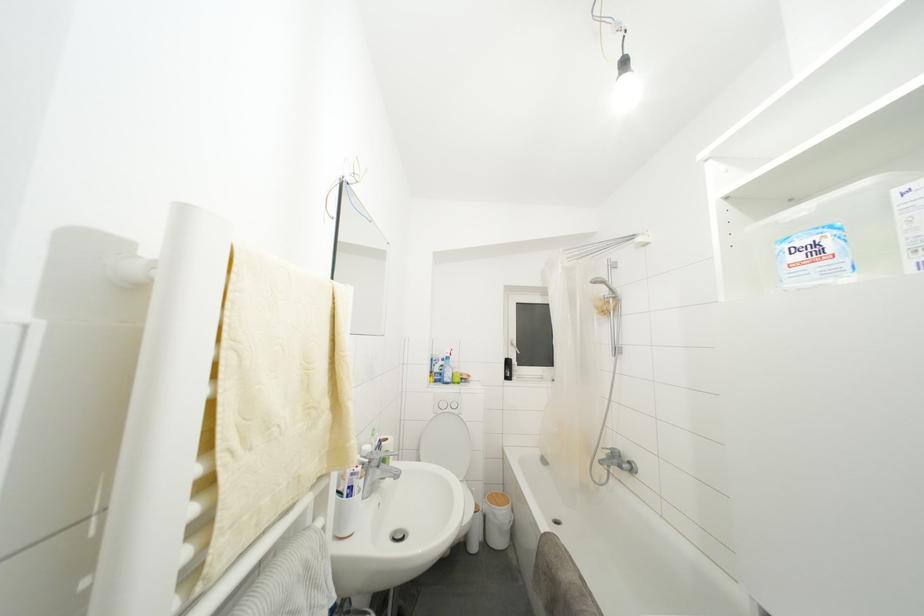
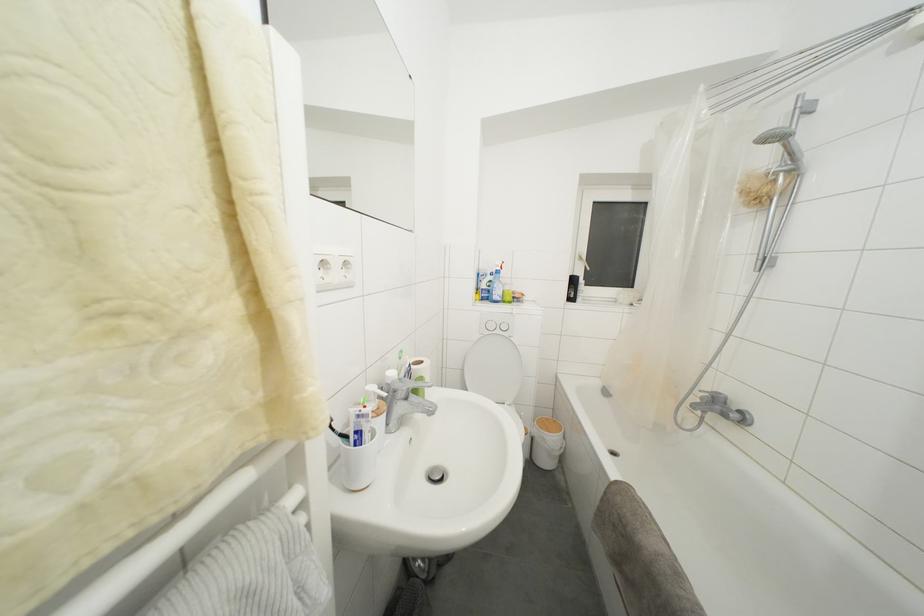
Find the pixel in the second image that matches point (492, 522) in the first image.

(541, 445)